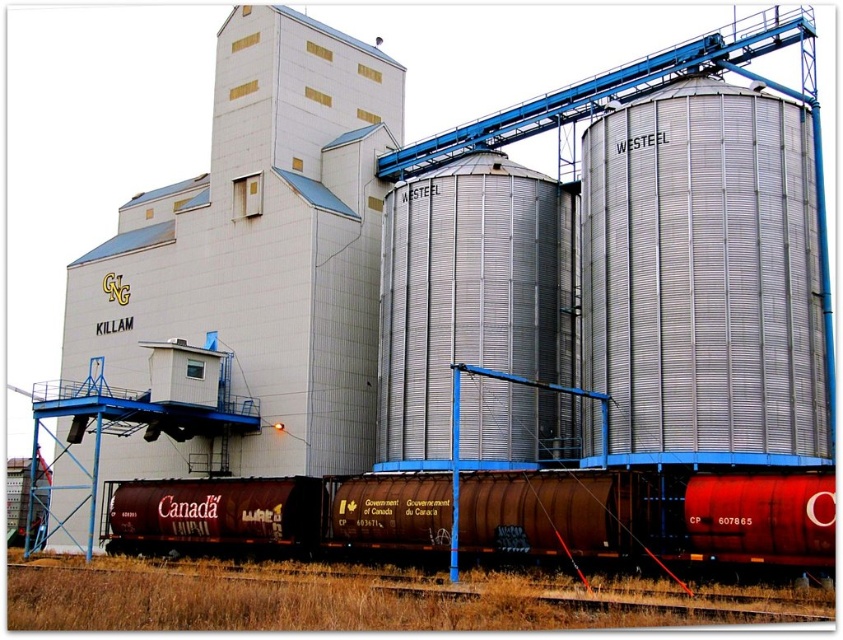
Question: Among these objects, which one is nearest to the camera?

Choices:
 (A) brown rusted metal train track at lower center
 (B) silver/aluminum silo at right

Answer: (A)

Question: Which point appears farthest from the camera in this image?

Choices:
 (A) [435, 602]
 (B) [468, 301]

Answer: (B)

Question: Which is farther from the silver metallic silo at center?

Choices:
 (A) rusty metal train car at lower center
 (B) brown rusted metal train track at lower center

Answer: (B)

Question: Is silver/aluminum silo at right above rusty metal train car at lower center?

Choices:
 (A) yes
 (B) no

Answer: (A)

Question: Is silver/aluminum silo at right wider than silver metallic silo at center?

Choices:
 (A) no
 (B) yes

Answer: (A)

Question: From the image, what is the correct spatial relationship of silver/aluminum silo at right in relation to brown rusted metal train track at lower center?

Choices:
 (A) below
 (B) above

Answer: (B)